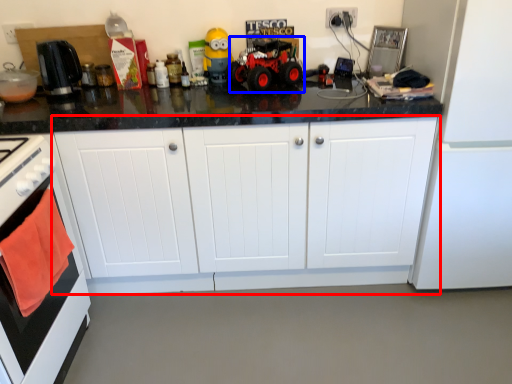
Question: Which point is further to the camera, cabinetry (highlighted by a red box) or toy car (highlighted by a blue box)?

Choices:
 (A) cabinetry
 (B) toy car

Answer: (B)